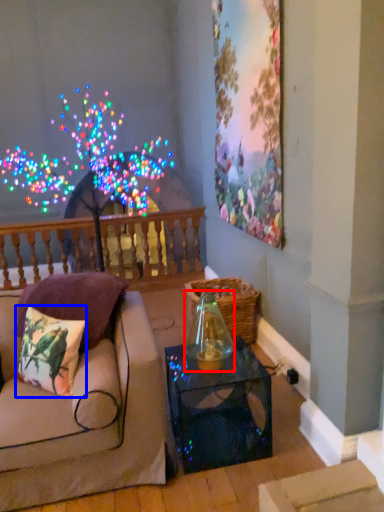
Question: Among these objects, which one is nearest to the camera, glass vase (highlighted by a red box) or pillow (highlighted by a blue box)?

Choices:
 (A) glass vase
 (B) pillow

Answer: (B)